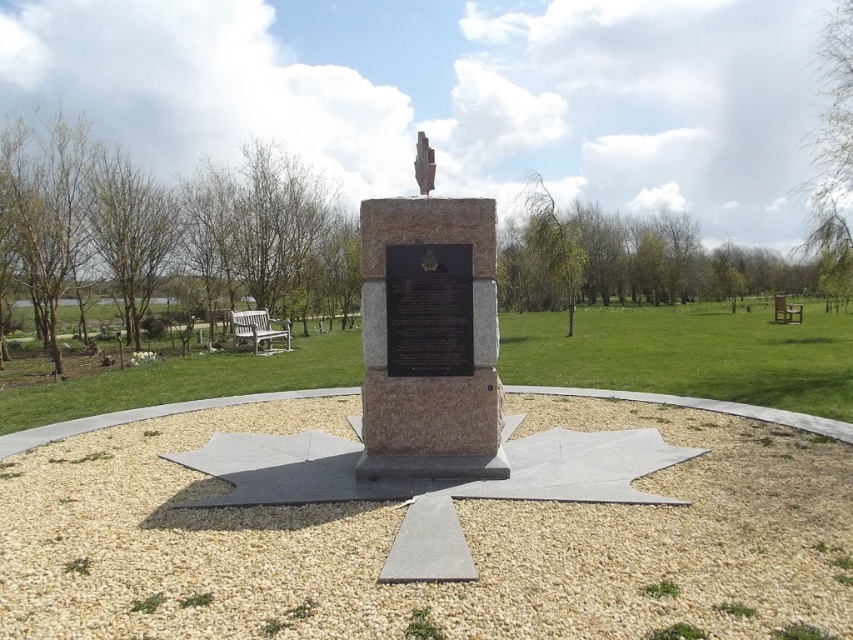
Where is `white wooden bench at lower left`? Image resolution: width=853 pixels, height=640 pixels. white wooden bench at lower left is located at coordinates pyautogui.click(x=257, y=330).

Does white wooden bench at lower left have a lesser width compared to wooden park bench at right?

Indeed, white wooden bench at lower left has a lesser width compared to wooden park bench at right.

Between point (265, 332) and point (799, 320), which one is positioned in front?

Point (265, 332)

Identify the location of white wooden bench at lower left. This screenshot has height=640, width=853. (257, 330).

Does white wooden bench at lower left have a lesser height compared to sculpture at center?

Yes.

Does point (230, 317) come closer to viewer compared to point (432, 170)?

No, it is not.

This screenshot has height=640, width=853. I want to click on white wooden bench at lower left, so click(257, 330).

Between granite stone monument at center and white wooden bench at lower left, which one has more height?

Result: With more height is granite stone monument at center.

This screenshot has height=640, width=853. In order to click on granite stone monument at center in this screenshot , I will do `click(428, 339)`.

Identify the location of granite stone monument at center. (428, 339).